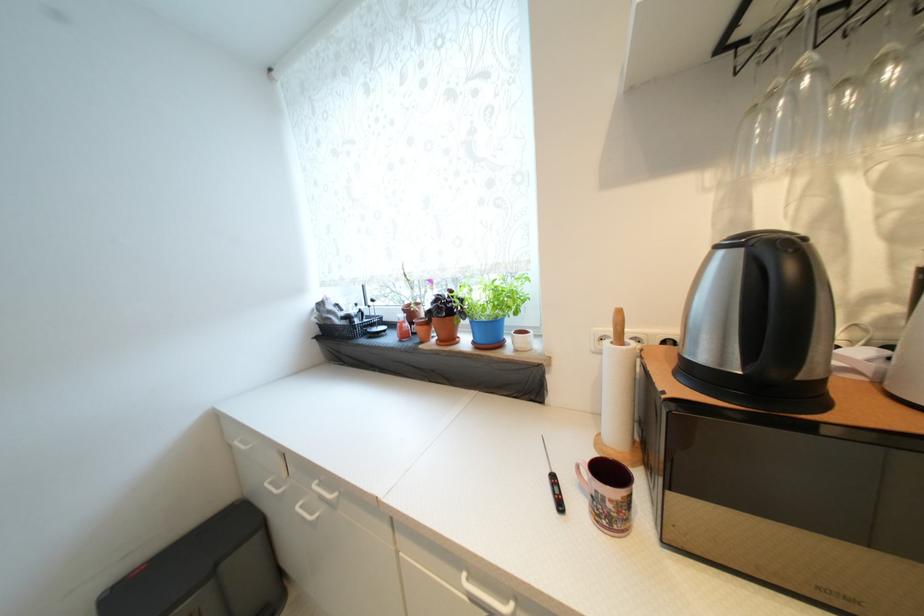
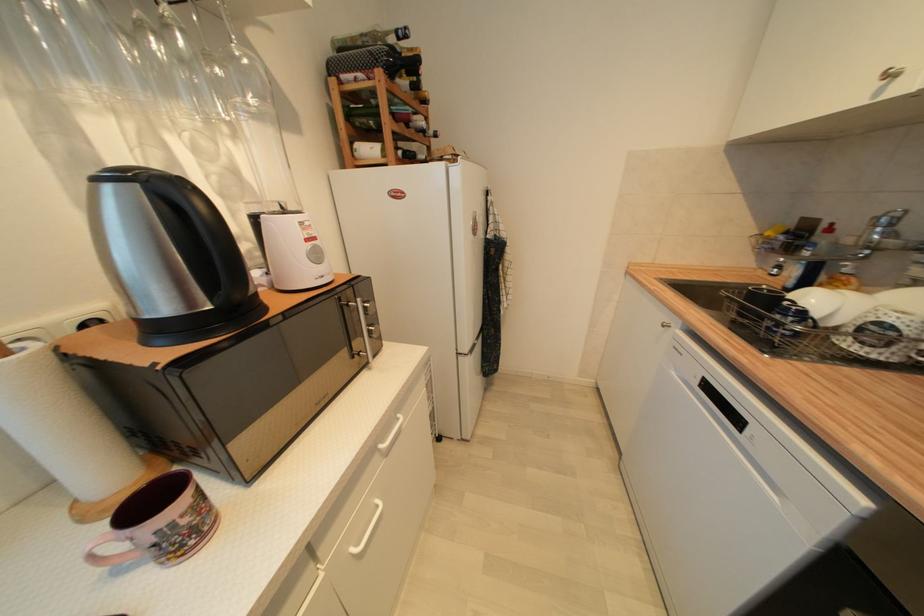
Based on the continuous images, in which direction is the camera rotating?

The camera rotated toward right-down.